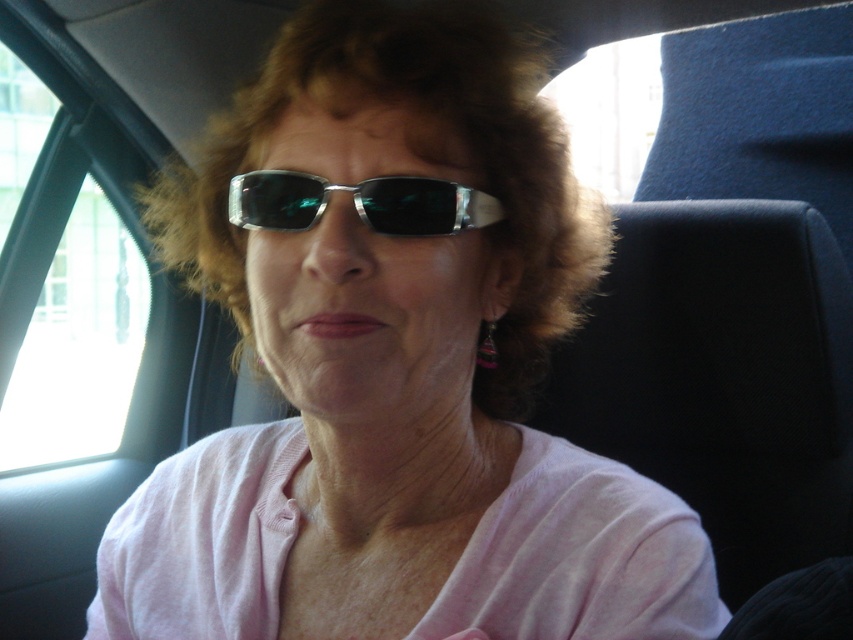
Locate an element on the screen. Image resolution: width=853 pixels, height=640 pixels. transparent glass window at upper left is located at coordinates (78, 342).

Is point (57, 413) farther from camera compared to point (299, 225)?

Yes, it is behind point (299, 225).

This screenshot has height=640, width=853. I want to click on transparent glass window at upper left, so click(78, 342).

Locate an element on the screen. The width and height of the screenshot is (853, 640). transparent glass window at upper left is located at coordinates (78, 342).